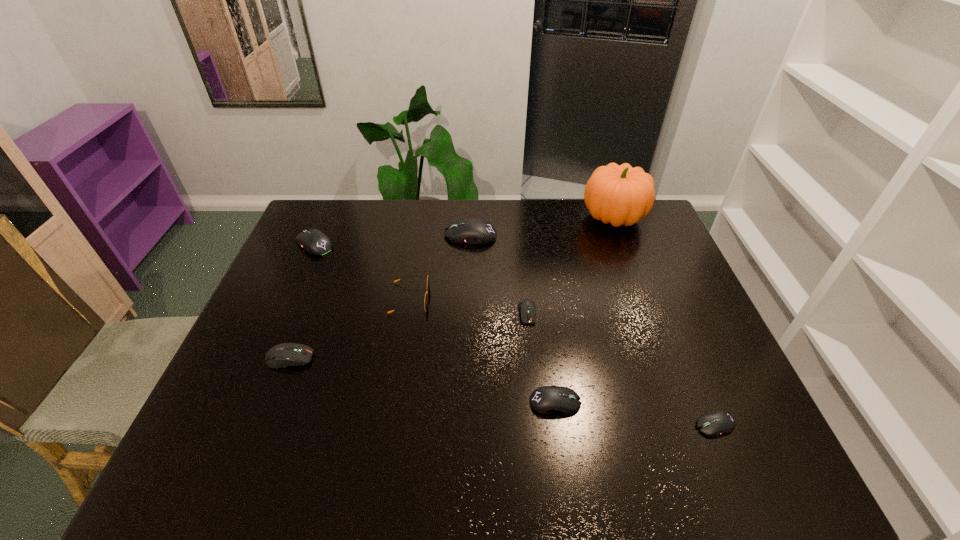
The width and height of the screenshot is (960, 540). I want to click on pumpkin, so click(620, 195).

Locate an element on the screen. The width and height of the screenshot is (960, 540). orange pumpkin is located at coordinates (620, 195).

The width and height of the screenshot is (960, 540). What are the coordinates of `the fourth object from left to right` in the screenshot? It's located at (473, 231).

At what (x,y) coordinates should I click in order to perform the action: click on the second tallest object. Please return your answer as a coordinate pair (x, y). The width and height of the screenshot is (960, 540). Looking at the image, I should click on (473, 231).

Where is `the third smallest black computer equipment`? This screenshot has height=540, width=960. the third smallest black computer equipment is located at coordinates (315, 242).

Image resolution: width=960 pixels, height=540 pixels. I want to click on black sunglasses, so click(428, 282).

The image size is (960, 540). In order to click on the sixth object from right to left in this screenshot , I will do click(428, 282).

Find the location of a particular element. The width and height of the screenshot is (960, 540). the sixth farthest object is located at coordinates (282, 355).

Locate an element on the screen. Image resolution: width=960 pixels, height=540 pixels. the nearer dark computer equipment is located at coordinates (282, 355).

You are a GUI agent. You are given a task and a screenshot of the screen. Output one action in this format:
    pyautogui.click(x=<x>, y=<y>)
    Task: Click on the second black computer equipment from right to left
    This screenshot has width=960, height=540.
    Given the screenshot: What is the action you would take?
    pyautogui.click(x=547, y=399)